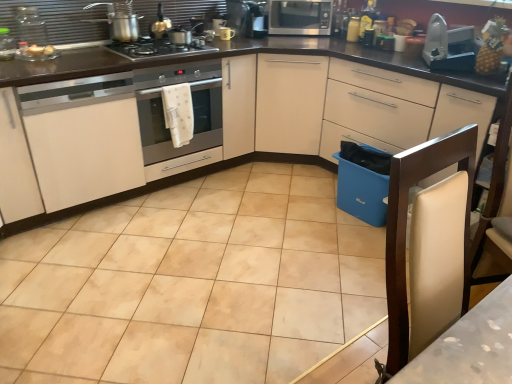
At what (x,y) coordinates should I click in order to perform the action: click on vacant area that lies in front of blue plastic bin at lower right. Please return your answer as a coordinate pair (x, y). Looking at the image, I should click on (354, 242).